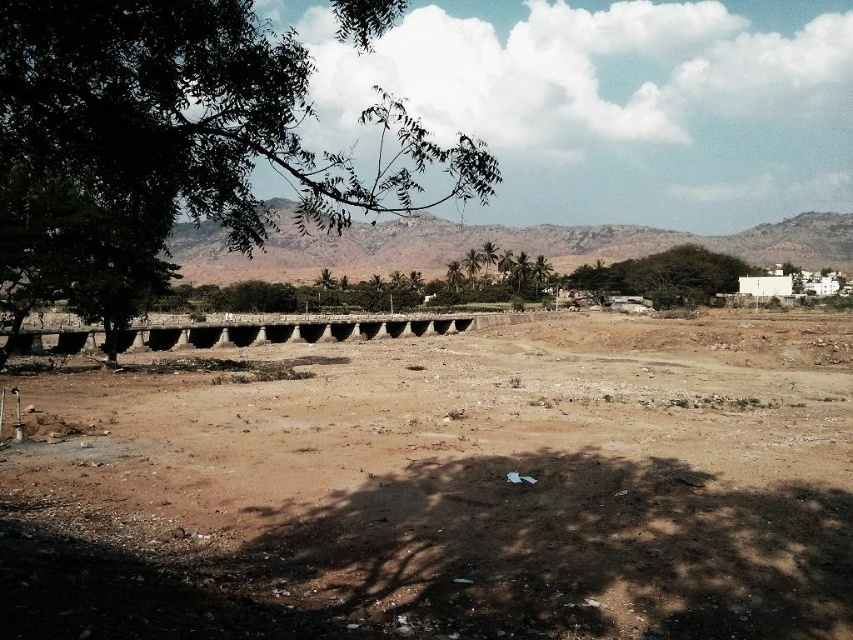
Can you confirm if brown sandy dirt field at center is wider than green leafy tree at left?

No.

Is brown sandy dirt field at center to the right of green leafy tree at left from the viewer's perspective?

Indeed, brown sandy dirt field at center is positioned on the right side of green leafy tree at left.

Is point (647, 440) less distant than point (111, 24)?

No, (647, 440) is behind (111, 24).

You are a GUI agent. You are given a task and a screenshot of the screen. Output one action in this format:
    pyautogui.click(x=<x>, y=<y>)
    Task: Click on the brown sandy dirt field at center
    
    Given the screenshot: What is the action you would take?
    pyautogui.click(x=444, y=486)